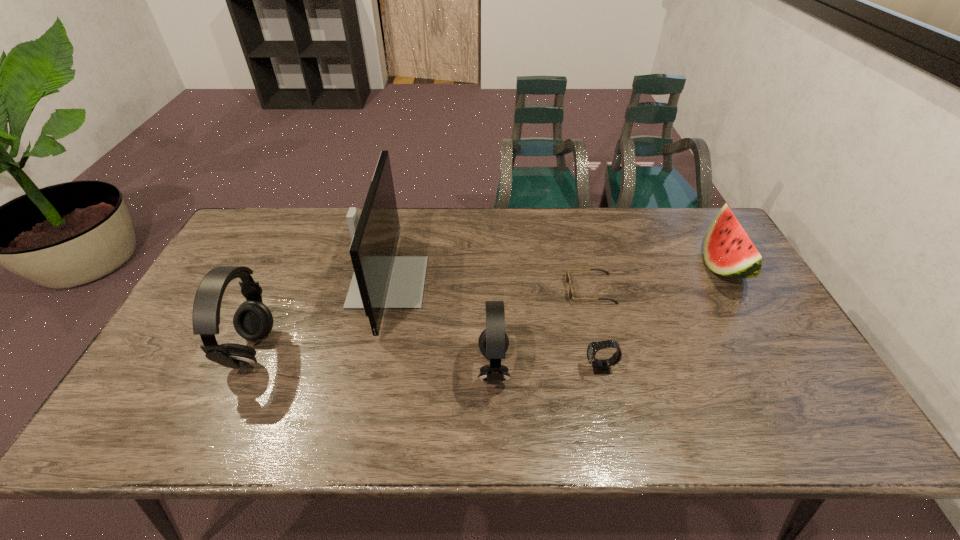
Locate an element on the screen. vacant space at the far edge is located at coordinates (441, 243).

Identify the location of free space at the near edge. Image resolution: width=960 pixels, height=540 pixels. (584, 390).

At what (x,y) coordinates should I click in order to perform the action: click on free space at the left edge of the desktop. Please return your answer as a coordinate pair (x, y). The height and width of the screenshot is (540, 960). Looking at the image, I should click on (216, 266).

I want to click on vacant space at the right edge of the desktop, so click(x=704, y=258).

This screenshot has height=540, width=960. Identify the location of free region at the far left corner of the desktop. (288, 216).

I want to click on vacant space at the near left corner, so click(x=180, y=383).

Locate an element on the screen. free location at the far right corner of the desktop is located at coordinates (695, 229).

At what (x,y) coordinates should I click in order to perform the action: click on blank region between the second tallest object and the second shortest object. Please return your answer as a coordinate pair (x, y). The width and height of the screenshot is (960, 540). Looking at the image, I should click on (426, 359).

Locate an element on the screen. The image size is (960, 540). free point between the right earphone and the second shortest object is located at coordinates pyautogui.click(x=547, y=368).

Locate an element on the screen. The height and width of the screenshot is (540, 960). free space between the sunglasses and the fourth tallest object is located at coordinates (657, 277).